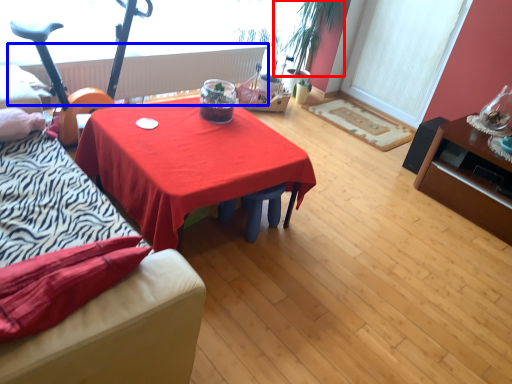
Question: Which object appears closest to the camera in this image, plant (highlighted by a red box) or radiator (highlighted by a blue box)?

Choices:
 (A) plant
 (B) radiator

Answer: (B)